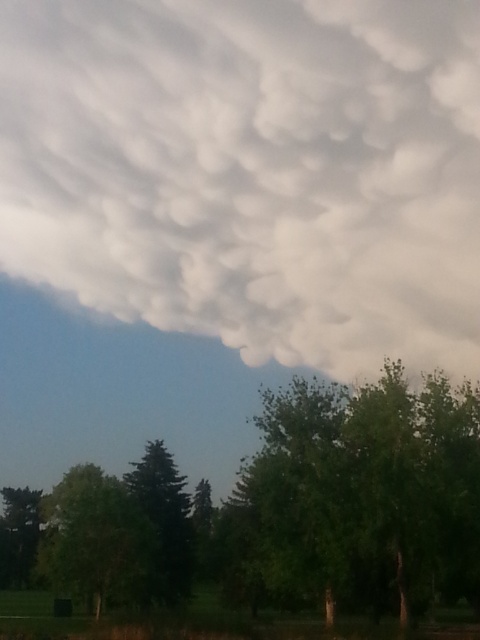
Is white fluffy cloud at upper center closer to camera compared to green matte tree at lower left?

Yes, it is in front of green matte tree at lower left.

The width and height of the screenshot is (480, 640). What do you see at coordinates (252, 172) in the screenshot? I see `white fluffy cloud at upper center` at bounding box center [252, 172].

Find the location of a particular element. white fluffy cloud at upper center is located at coordinates [252, 172].

Between white fluffy cloud at upper center and green leafy tree at lower left, which one appears on the right side from the viewer's perspective?

white fluffy cloud at upper center is more to the right.

Is white fluffy cloud at upper center positioned before green leafy tree at lower left?

That is True.

Describe the element at coordinates (252, 172) in the screenshot. The height and width of the screenshot is (640, 480). I see `white fluffy cloud at upper center` at that location.

Identify the location of white fluffy cloud at upper center. The height and width of the screenshot is (640, 480). (252, 172).

Is white fluffy cloud at upper center bigger than green matte tree at center?

Correct, white fluffy cloud at upper center is larger in size than green matte tree at center.

Is point (82, 232) in front of point (170, 520)?

No, (82, 232) is further to viewer.

Identify the location of white fluffy cloud at upper center. (252, 172).